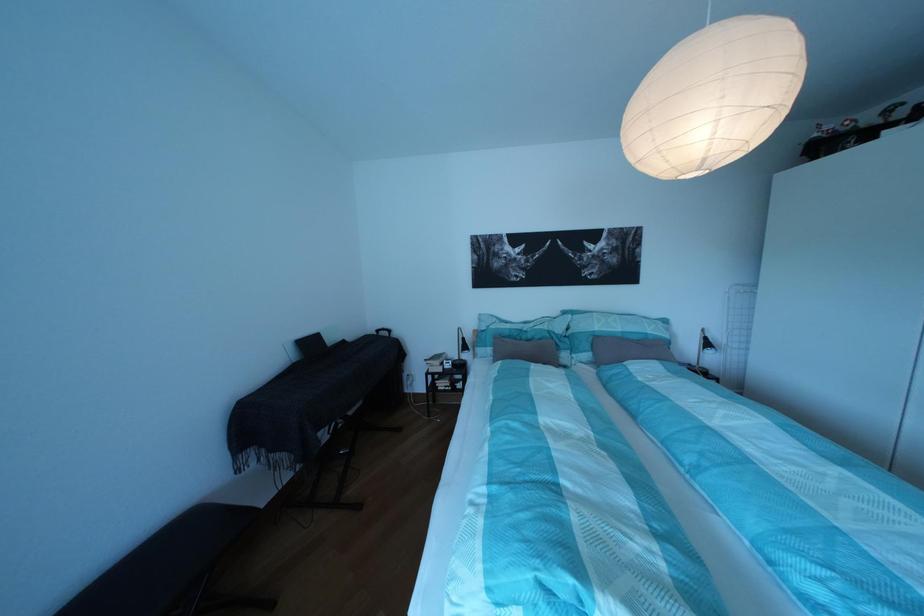
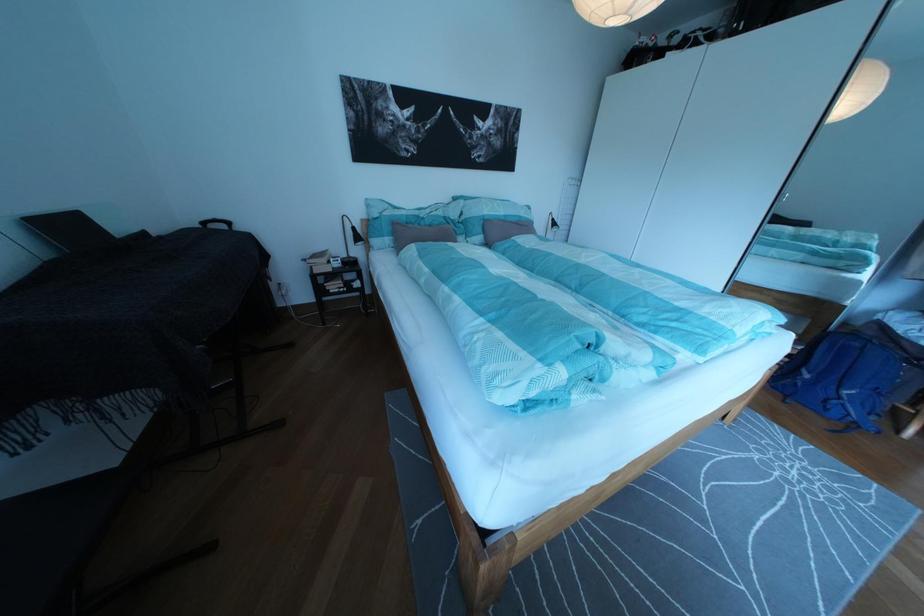
Based on the photo, based on the continuous images, in which direction is the camera rotating?

The rotation direction of the camera is right-down.